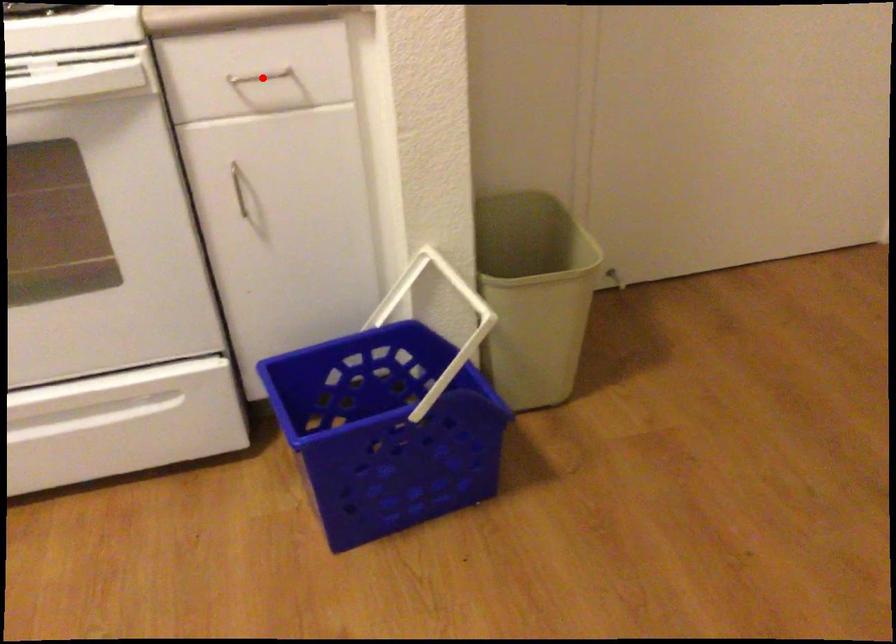
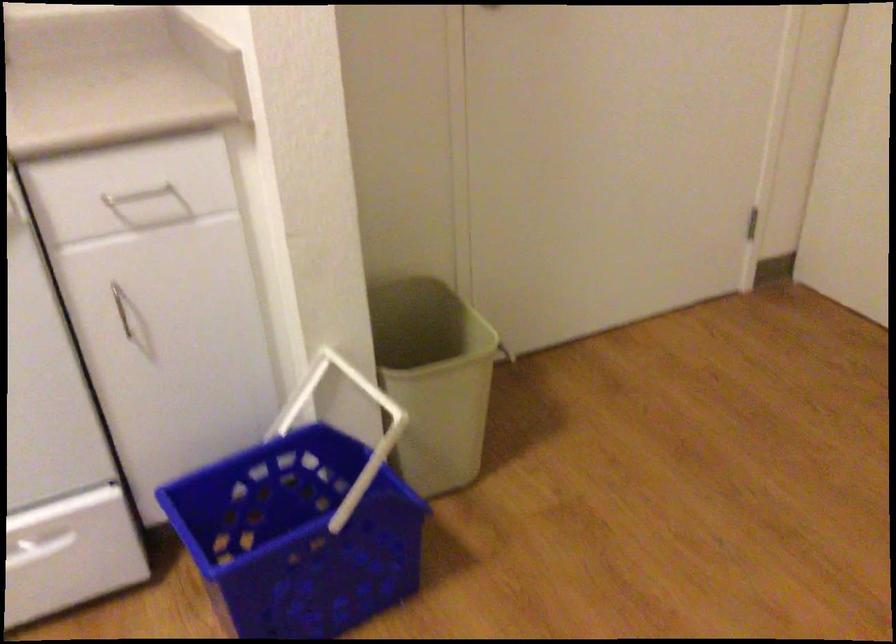
Where in the second image is the point corresponding to the highlighted location from the first image?

(138, 194)